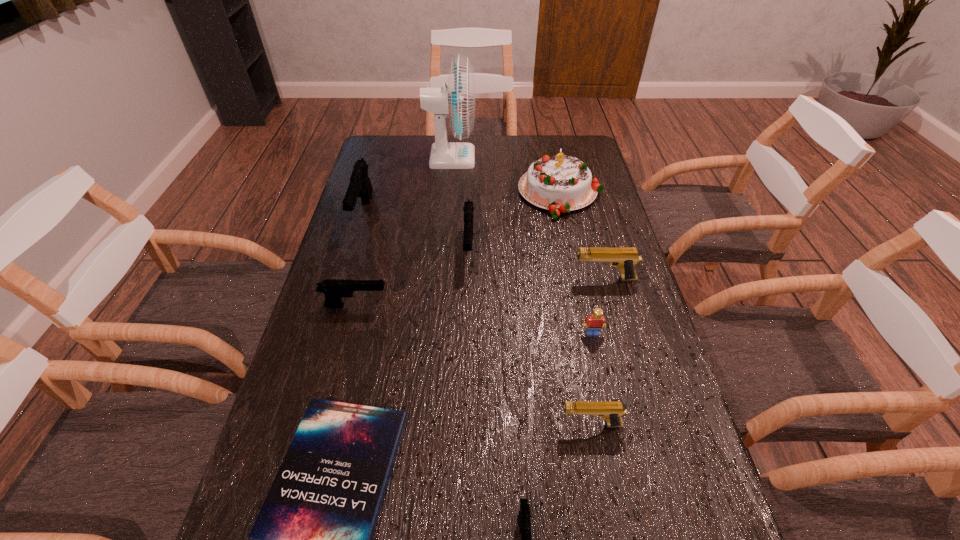
I want to click on fan, so click(457, 99).

Where is `white fan`? white fan is located at coordinates (457, 99).

Find the location of a particular element. cake is located at coordinates (558, 183).

This screenshot has height=540, width=960. Identify the location of the biggest black pistol. (360, 185).

Where is `the second black pistol from right to left`? This screenshot has height=540, width=960. the second black pistol from right to left is located at coordinates (468, 208).

The image size is (960, 540). Find the location of `the third smallest black pistol`. the third smallest black pistol is located at coordinates click(468, 208).

Locate an element on the screen. the fourth nearest pistol is located at coordinates (625, 258).

This screenshot has height=540, width=960. What are the coordinates of `the farther tan pistol` in the screenshot? It's located at (625, 258).

The width and height of the screenshot is (960, 540). Identify the location of the fifth nearest object. (334, 289).

Image resolution: width=960 pixels, height=540 pixels. Identify the location of the second smallest black pistol. (334, 289).